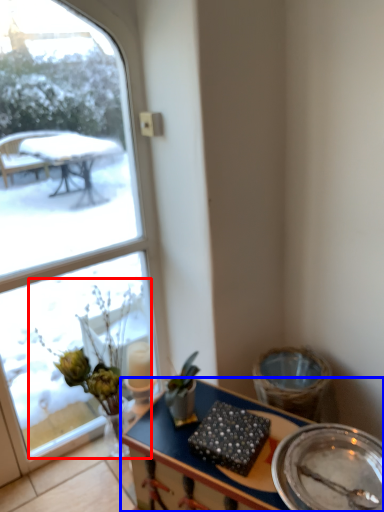
Question: Which object is closer to the camera taking this photo, floral arrangement (highlighted by a red box) or desk (highlighted by a blue box)?

Choices:
 (A) floral arrangement
 (B) desk

Answer: (B)